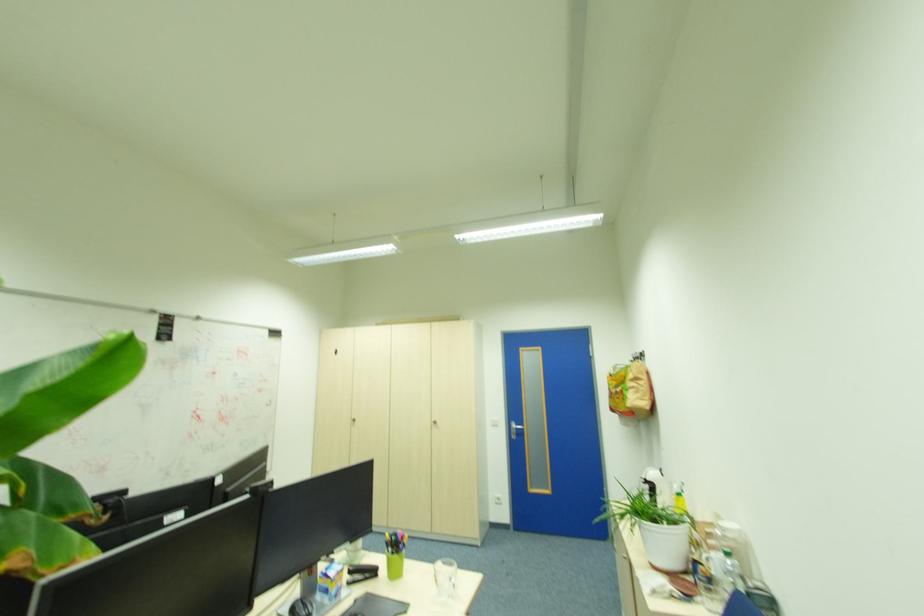
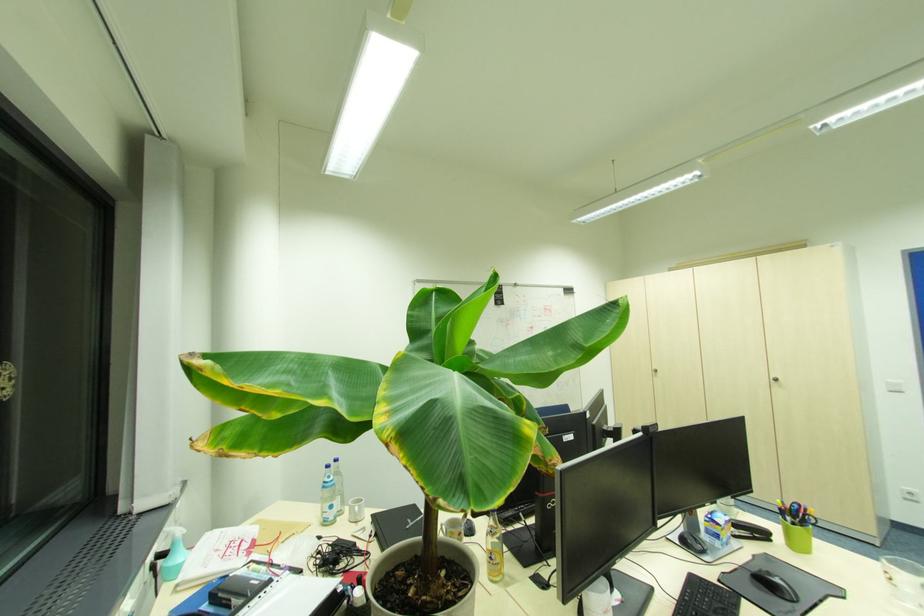
In the second image, find the point that corresponds to point (397, 554) in the first image.

(798, 525)